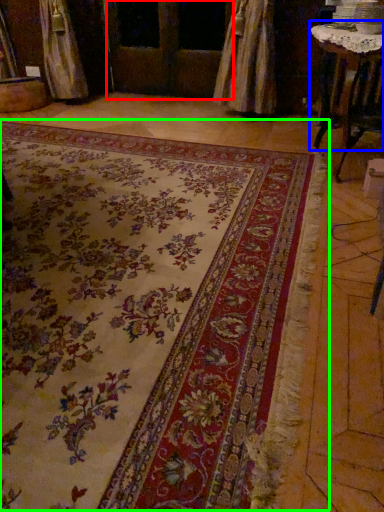
Question: Estimate the real-world distances between objects in this image. Which object is closer to screen door (highlighted by a red box), table (highlighted by a blue box) or mat (highlighted by a green box)?

Choices:
 (A) table
 (B) mat

Answer: (A)